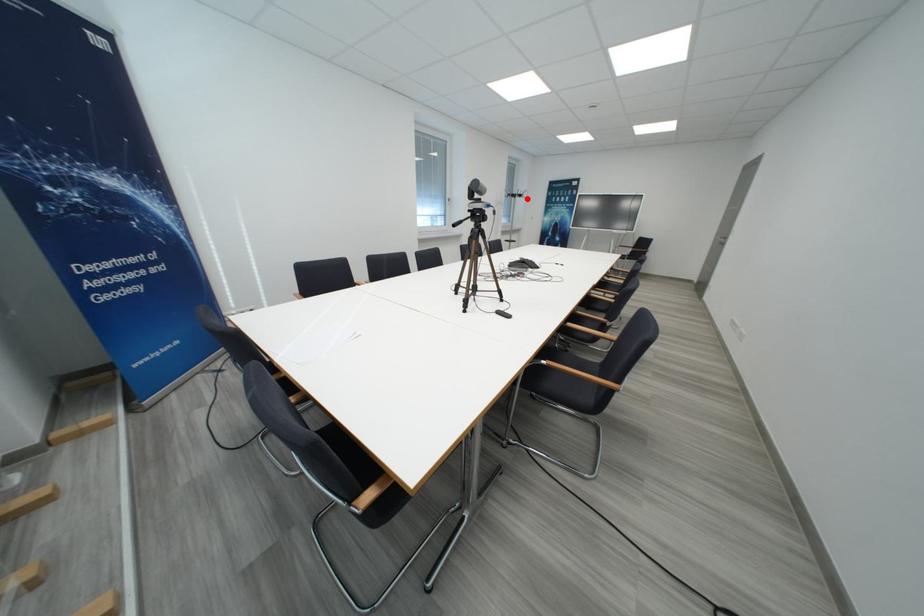
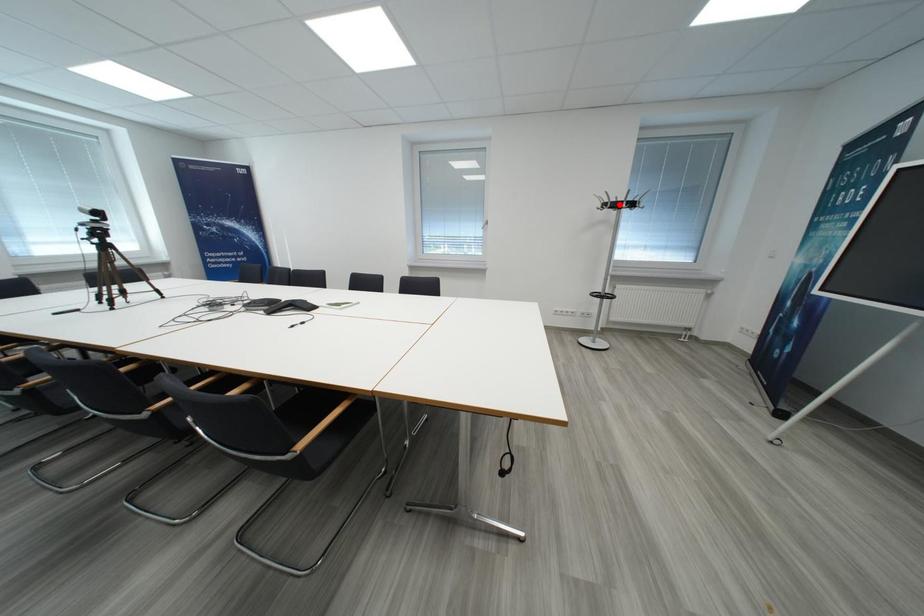
I am providing you with two images of the same scene from different viewpoints. A red point is marked on the first image and another point is marked on the second image. Is the marked point in image1 the same physical position as the marked point in image2?

No